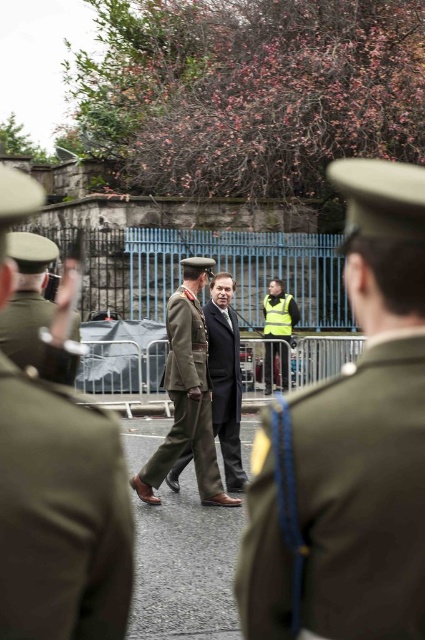
Does dark brown leather shoes at center have a lesser width compared to green military uniform at left?

Yes.

This screenshot has width=425, height=640. In order to click on dark brown leather shoes at center in this screenshot , I will do point(350,445).

Find the location of a particular element. This screenshot has height=640, width=425. dark brown leather shoes at center is located at coordinates (350, 445).

Does dark brown leather shoes at center lie behind camouflage fabric uniform at center?

That is False.

Is dark brown leather shoes at center above camouflage fabric uniform at center?

Indeed, dark brown leather shoes at center is positioned over camouflage fabric uniform at center.

Is point (396, 541) positioned in front of point (180, 340)?

Yes, point (396, 541) is closer to viewer.

Identify the location of dark brown leather shoes at center. (350, 445).

Does green military uniform at center appear on the right side of green military uniform at left?

Yes, green military uniform at center is to the right of green military uniform at left.

Between green military uniform at center and green military uniform at left, which one has less height?

With less height is green military uniform at center.

Between point (53, 573) and point (8, 243), which one is positioned in front?

Point (53, 573) is more forward.

This screenshot has width=425, height=640. I want to click on green military uniform at center, so click(x=62, y=515).